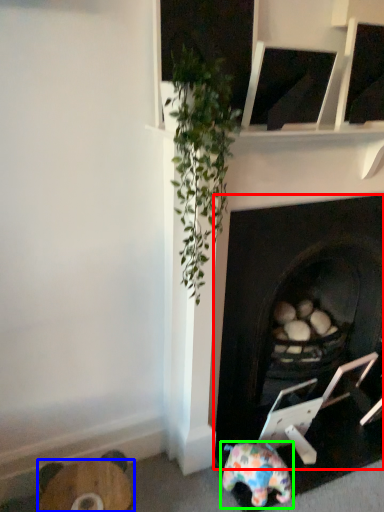
Question: Considering the real-world distances, which object is farthest from fireplace (highlighted by a red box)? furniture (highlighted by a blue box) or toy (highlighted by a green box)?

Choices:
 (A) furniture
 (B) toy

Answer: (A)